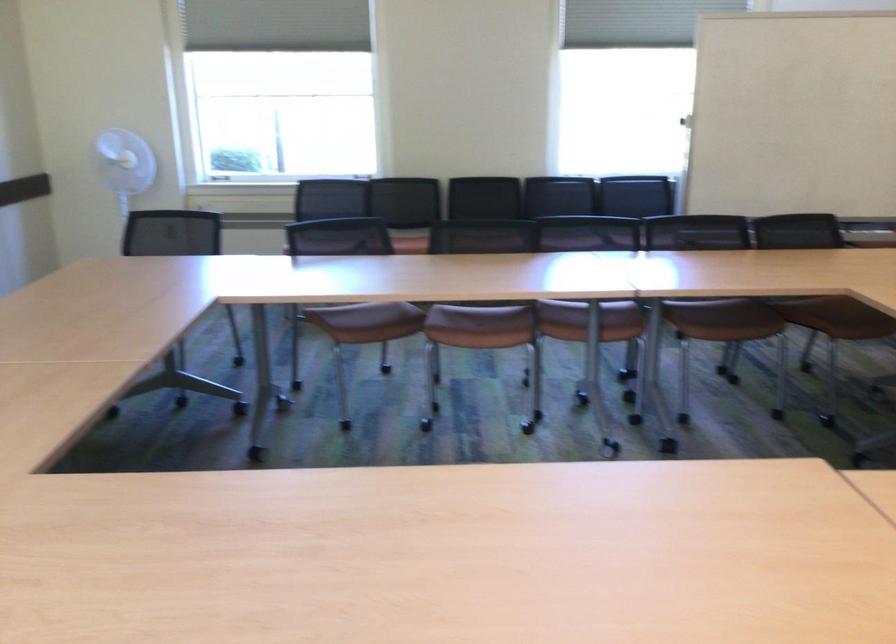
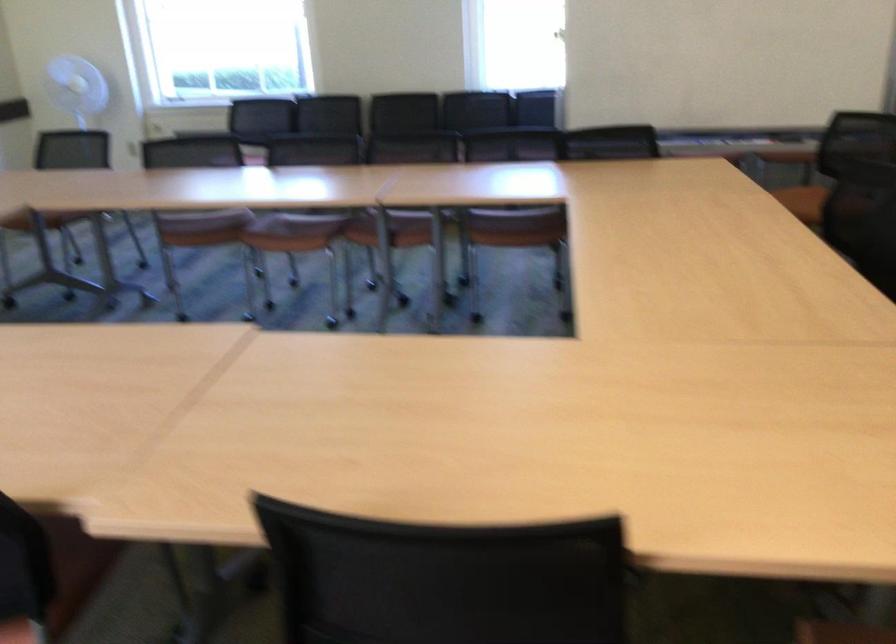
Question: What movement of the cameraman would produce the second image?

Choices:
 (A) Left
 (B) Right
 (C) Forward
 (D) Backward

Answer: (B)